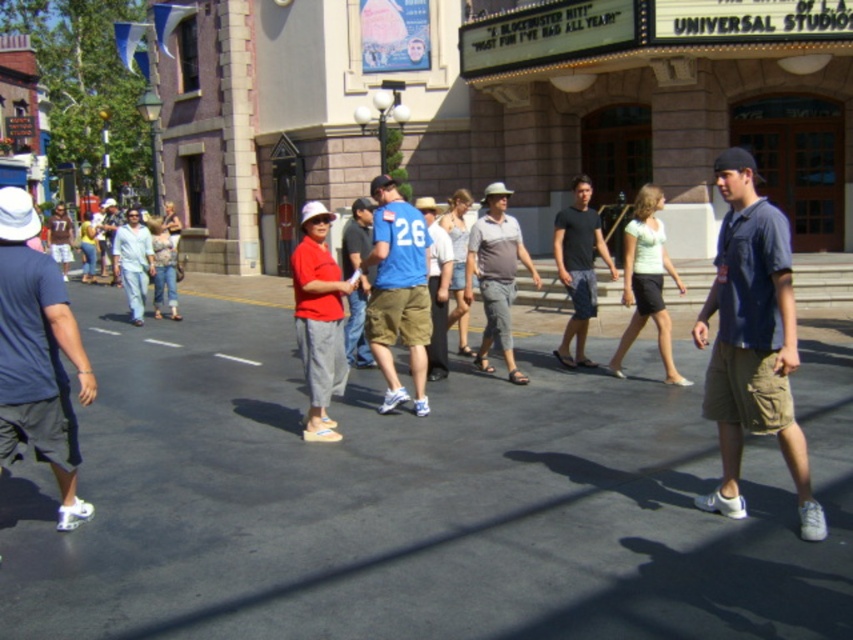
Question: Among these objects, which one is nearest to the camera?

Choices:
 (A) blue fabric shirt at center
 (B) dark blue t-shirt at left
 (C) light blue jeans at center
 (D) black cotton shirt at center

Answer: (B)

Question: Does gray cotton shirt at center appear over blue jersey at center?

Choices:
 (A) yes
 (B) no

Answer: (A)

Question: Considering the relative positions of light blue jeans at center and blue jersey at center in the image provided, where is light blue jeans at center located with respect to blue jersey at center?

Choices:
 (A) below
 (B) above

Answer: (B)

Question: Considering the real-world distances, which object is closest to the blue denim shirt at center?

Choices:
 (A) blue fabric shirt at center
 (B) gray cotton shirt at center
 (C) blue jersey at center
 (D) dark blue t-shirt at left

Answer: (A)

Question: Which of these objects is positioned farthest from the dark blue t-shirt at left?

Choices:
 (A) blue denim shirt at center
 (B) blue fabric shirt at center

Answer: (A)

Question: Can you confirm if gray cotton shirt at center is positioned to the right of light blue jeans at center?

Choices:
 (A) yes
 (B) no

Answer: (A)